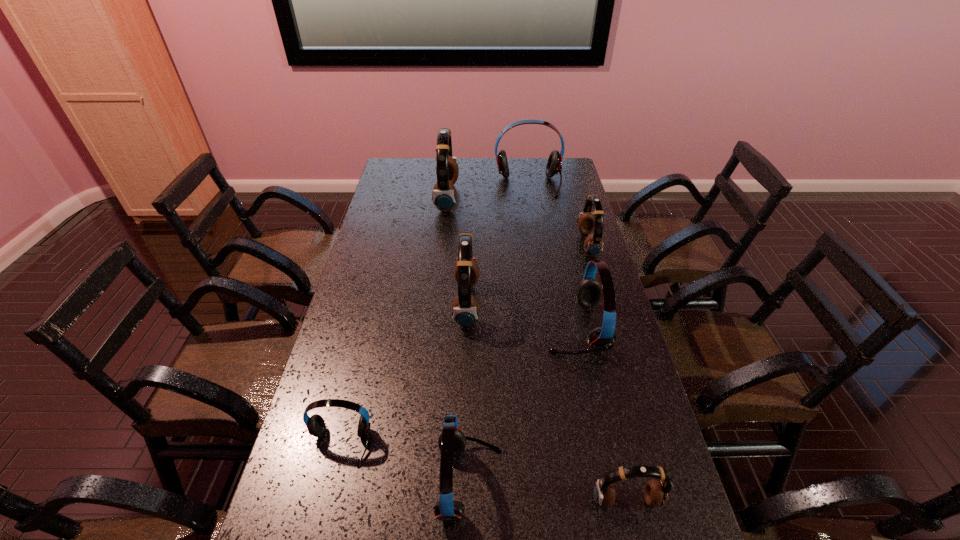
This screenshot has width=960, height=540. Find the location of `free region located on the ear cup of the third farthest headset`. free region located on the ear cup of the third farthest headset is located at coordinates (558, 245).

Identify the location of vacant region located with the microphone attached to the side of the third biggest red headset. The height and width of the screenshot is (540, 960). (564, 483).

Where is `free space located on the ear cup of the smallest brown headset`? This screenshot has width=960, height=540. free space located on the ear cup of the smallest brown headset is located at coordinates (636, 538).

Locate an element on the screen. The width and height of the screenshot is (960, 540). vacant region located 0.060m with the microphone attached to the side of the leftmost object is located at coordinates (327, 494).

Locate an element on the screen. This screenshot has width=960, height=540. object present at the left edge is located at coordinates (315, 424).

Locate an element on the screen. This screenshot has height=540, width=960. object at the far right corner is located at coordinates pos(554,164).

I want to click on vacant space at the far edge of the desktop, so click(514, 177).

In the image, there is a desktop. At what (x,y) coordinates should I click in order to perform the action: click on vacant region at the left edge. Please return your answer as a coordinate pair (x, y). The height and width of the screenshot is (540, 960). Looking at the image, I should click on (395, 244).

The image size is (960, 540). I want to click on blank space at the right edge, so click(x=564, y=201).

You are a GUI agent. You are given a task and a screenshot of the screen. Output one action in this format:
    pyautogui.click(x=<x>, y=<y>)
    Task: Click on the free point at the far right corner
    The height and width of the screenshot is (540, 960).
    Given the screenshot: What is the action you would take?
    pyautogui.click(x=564, y=171)